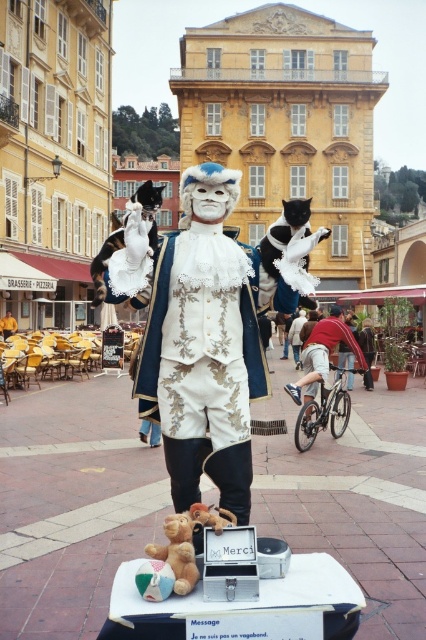
Question: Which object is positioned closest to the black and white fur cat at center?

Choices:
 (A) brown plush teddy bear at lower center
 (B) white lace fabric costume at center
 (C) red cotton shirt at center

Answer: (B)

Question: Which point is closer to the camera?

Choices:
 (A) (140, 406)
 (B) (293, 280)
 (C) (313, 378)

Answer: (B)

Question: Is black and white fur cat at center smaller than red cotton shirt at center?

Choices:
 (A) no
 (B) yes

Answer: (A)

Question: Can you confirm if white lace fabric costume at center is bigger than black and white fur cat at center?

Choices:
 (A) no
 (B) yes

Answer: (A)

Question: Which object appears farthest from the camera in this image?

Choices:
 (A) black and white fur cat at center
 (B) red cotton shirt at center
 (C) brown plush teddy bear at lower center
 (D) white lace fabric costume at center

Answer: (B)

Question: Considering the relative positions of black and white fur cat at center and brown plush teddy bear at lower center in the image provided, where is black and white fur cat at center located with respect to brown plush teddy bear at lower center?

Choices:
 (A) left
 (B) right

Answer: (B)